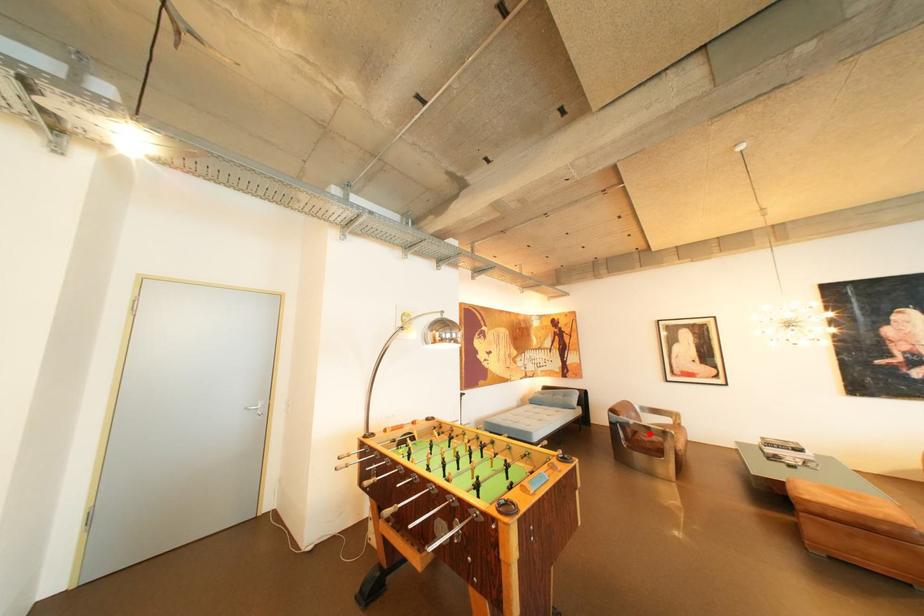
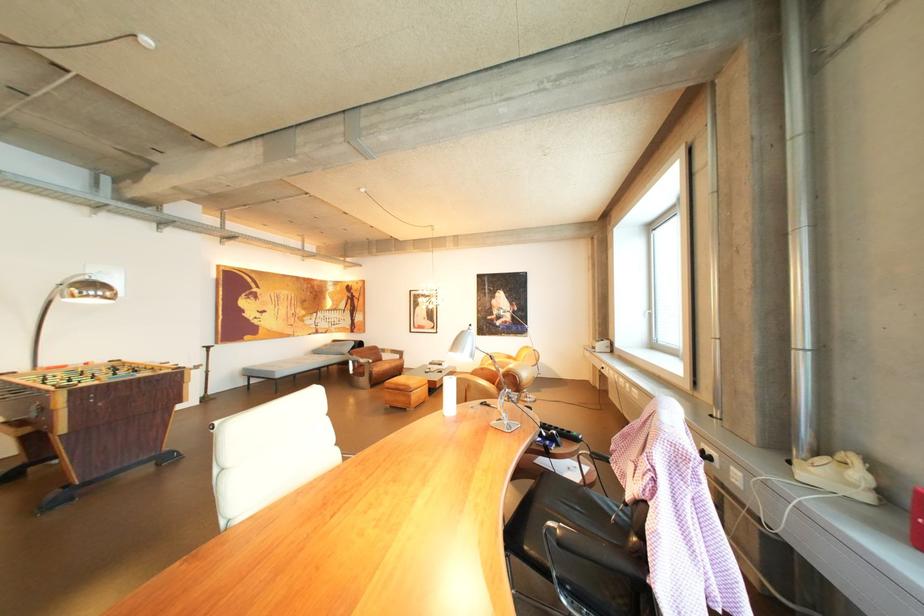
In the second image, find the point that corresponds to the highlighted location in the first image.

(374, 366)